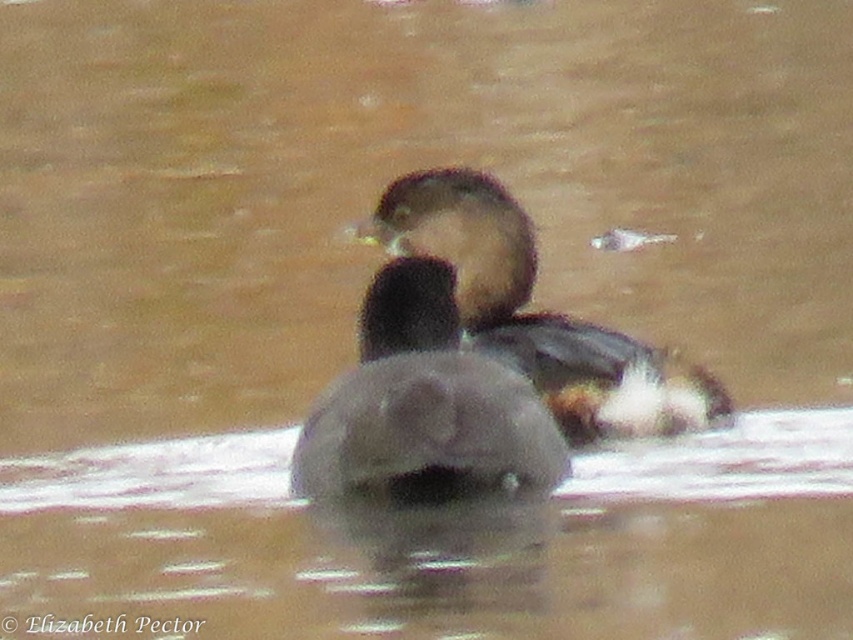
Consider the image. You are observing a duck in a pond. You notice the brown matte duck at center and the brown speckled feathers at center. Which object is located more to the left?

The brown matte duck at center is positioned on the left side of brown speckled feathers at center, so it is more to the left.

You are a wildlife photographer trying to capture a clear shot of the brown matte duck at center and the brown speckled feathers at center. Since you need to focus on both subjects, which one should you adjust your camera focus to prioritize first based on their positions?

The brown matte duck at center is shorter than brown speckled feathers at center, so you should prioritize focusing on the brown speckled feathers at center first because it is closer to the camera.

You are a wildlife photographer aiming to capture the brown matte duck at center in the image. Based on its position coordinates, where should you focus your camera lens?

The brown matte duck at center is located at point coordinates 0.634 on the x axis and 0.497 on the y axis, so you should focus your camera lens at those coordinates to capture the duck.